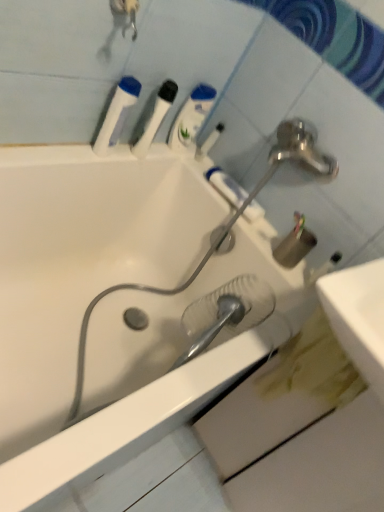
Question: From the image's perspective, is white matte toothpaste at upper center located beneath white plastic toothbrush at upper center?

Choices:
 (A) no
 (B) yes

Answer: (B)

Question: Considering the relative positions of white matte toothpaste at upper center and white plastic toothbrush at upper center in the image provided, is white matte toothpaste at upper center to the left of white plastic toothbrush at upper center from the viewer's perspective?

Choices:
 (A) yes
 (B) no

Answer: (B)

Question: Is white matte toothpaste at upper center bigger than white plastic toothbrush at upper center?

Choices:
 (A) no
 (B) yes

Answer: (B)

Question: From a real-world perspective, is white matte toothpaste at upper center over white plastic toothbrush at upper center?

Choices:
 (A) no
 (B) yes

Answer: (A)

Question: Is white matte toothpaste at upper center outside of white plastic toothbrush at upper center?

Choices:
 (A) no
 (B) yes

Answer: (B)

Question: Is translucent plastic shower head at center inside or outside of white glossy bathtub at center?

Choices:
 (A) outside
 (B) inside

Answer: (B)

Question: In terms of size, does translucent plastic shower head at center appear bigger or smaller than white glossy bathtub at center?

Choices:
 (A) big
 (B) small

Answer: (B)

Question: Relative to white glossy bathtub at center, is translucent plastic shower head at center in front or behind?

Choices:
 (A) front
 (B) behind

Answer: (B)

Question: Considering the positions of translucent plastic shower head at center and white glossy bathtub at center in the image, is translucent plastic shower head at center taller or shorter than white glossy bathtub at center?

Choices:
 (A) short
 (B) tall

Answer: (A)

Question: Looking at their shapes, would you say white plastic toothbrush at upper center, placed as the second mouthwash when sorted from right to left, is wider or thinner than translucent plastic shower head at center?

Choices:
 (A) wide
 (B) thin

Answer: (B)

Question: Is white plastic toothbrush at upper center, placed as the second mouthwash when sorted from right to left, bigger or smaller than translucent plastic shower head at center?

Choices:
 (A) small
 (B) big

Answer: (A)

Question: Considering the positions of point (144, 155) and point (185, 326), is point (144, 155) closer or farther from the camera than point (185, 326)?

Choices:
 (A) closer
 (B) farther

Answer: (A)

Question: Is white plastic toothbrush at upper center, placed as the second mouthwash when sorted from right to left, inside the boundaries of translucent plastic shower head at center, or outside?

Choices:
 (A) inside
 (B) outside

Answer: (B)

Question: Considering the relative positions of translucent plastic shower head at center and white plastic toothbrush at upper center in the image provided, is translucent plastic shower head at center to the left or to the right of white plastic toothbrush at upper center?

Choices:
 (A) left
 (B) right

Answer: (B)

Question: Does point (231, 314) appear closer or farther from the camera than point (211, 144)?

Choices:
 (A) closer
 (B) farther

Answer: (A)